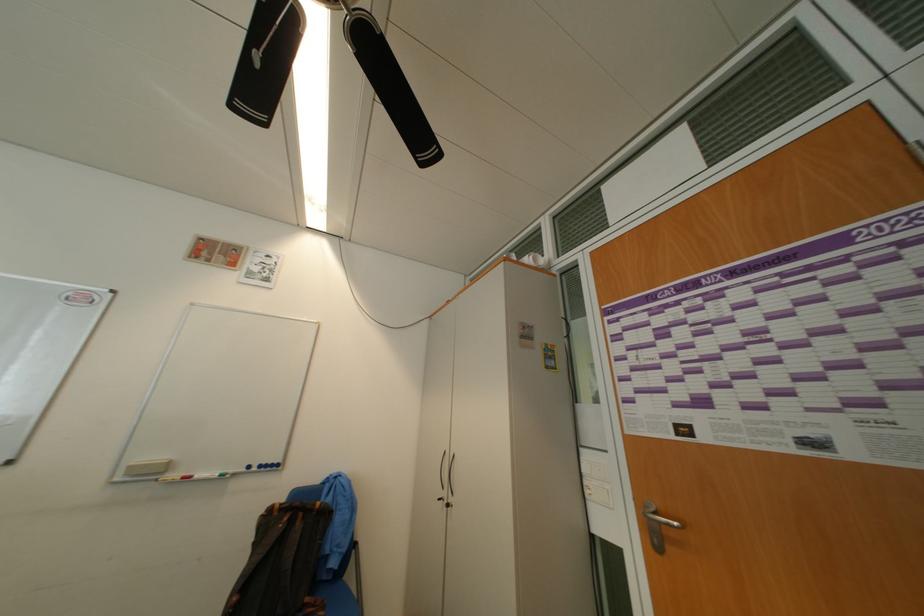
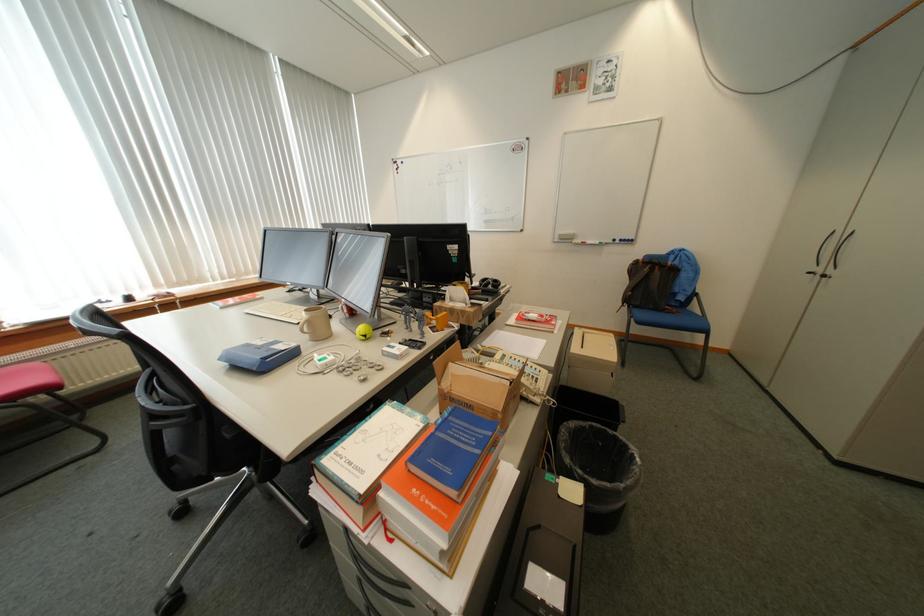
First-person continuous shooting, in which direction is the camera rotating?

The camera rotated toward left-down.